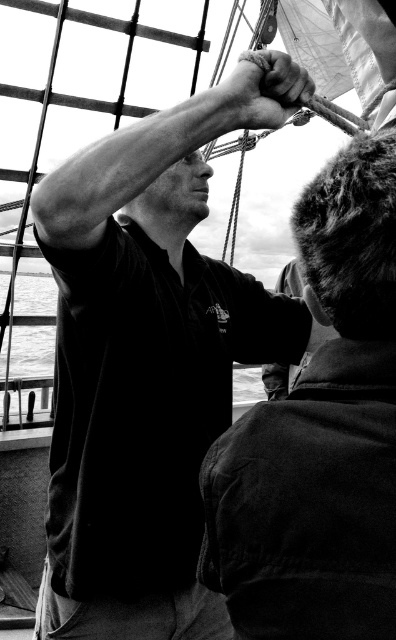
Question: Among these points, which one is farthest from the camera?

Choices:
 (A) (53, 497)
 (B) (270, 77)

Answer: (A)

Question: Does smooth black shirt at center have a lesser width compared to smooth metal hand at center?

Choices:
 (A) no
 (B) yes

Answer: (A)

Question: Does dark fabric jacket at center appear under smooth water at center?

Choices:
 (A) no
 (B) yes

Answer: (A)

Question: Which object is farther from the camera taking this photo?

Choices:
 (A) dark fabric jacket at center
 (B) smooth black shirt at center
 (C) smooth water at center
 (D) smooth metal hand at center

Answer: (C)

Question: Which point appears farthest from the camera in this image?

Choices:
 (A) (287, 115)
 (B) (192, 113)
 (C) (344, 200)
 (D) (0, 301)

Answer: (D)

Question: Is smooth black shirt at center to the left of smooth water at center from the viewer's perspective?

Choices:
 (A) no
 (B) yes

Answer: (A)